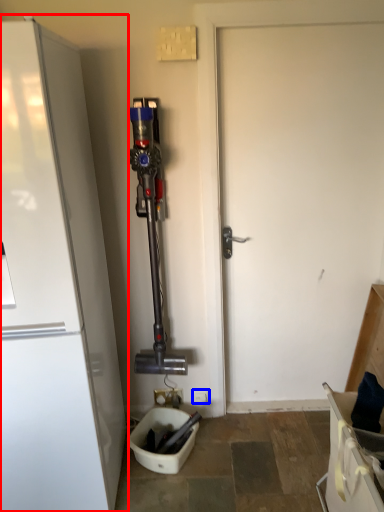
Question: Which point is closer to the camera, refrigerator (highlighted by a red box) or electric outlet (highlighted by a blue box)?

Choices:
 (A) refrigerator
 (B) electric outlet

Answer: (A)